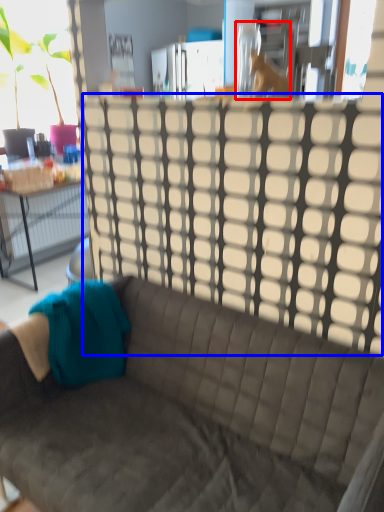
Question: Which of the following is the farthest to the observer, animal (highlighted by a red box) or glass door (highlighted by a blue box)?

Choices:
 (A) animal
 (B) glass door

Answer: (A)